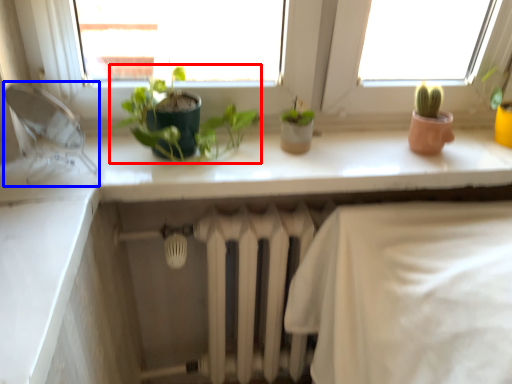
Question: Which object appears closest to the camera in this image, houseplant (highlighted by a red box) or faucet (highlighted by a blue box)?

Choices:
 (A) houseplant
 (B) faucet

Answer: (B)